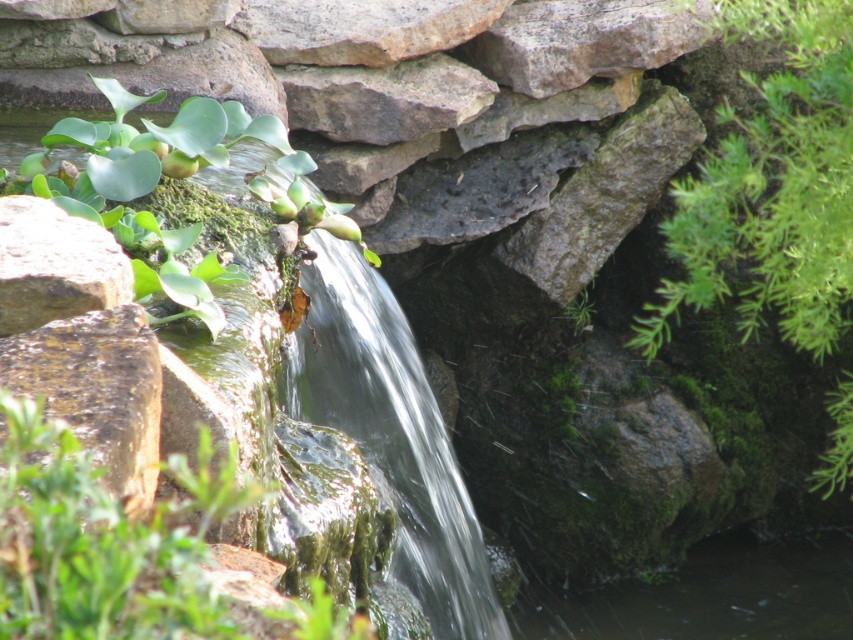
Question: Is green leafy plant at right to the left of green leafy plant at center from the viewer's perspective?

Choices:
 (A) no
 (B) yes

Answer: (A)

Question: Does green leafy plant at right appear on the left side of green leafy plant at center?

Choices:
 (A) no
 (B) yes

Answer: (A)

Question: Is the position of green leafy plant at center more distant than that of green leafy plant at upper left?

Choices:
 (A) yes
 (B) no

Answer: (B)

Question: Which object is closer to the camera taking this photo?

Choices:
 (A) green leafy plant at right
 (B) clear water at center
 (C) green leafy plant at center
 (D) green leafy plant at upper left

Answer: (C)

Question: Which of the following is the closest to the observer?

Choices:
 (A) (708, 236)
 (B) (83, 140)
 (C) (106, 636)
 (D) (442, 637)

Answer: (C)

Question: Which object appears farthest from the camera in this image?

Choices:
 (A) green leafy plant at right
 (B) clear water at center
 (C) green leafy plant at upper left
 (D) green leafy plant at center

Answer: (B)